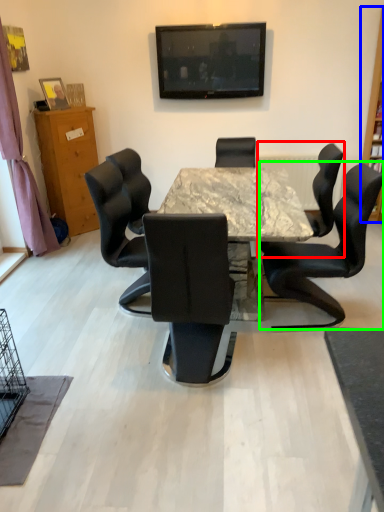
Question: Which object is the closest to the chair (highlighted by a red box)? Choose among these: bookshelf (highlighted by a blue box) or chair (highlighted by a green box).

Choices:
 (A) bookshelf
 (B) chair

Answer: (B)